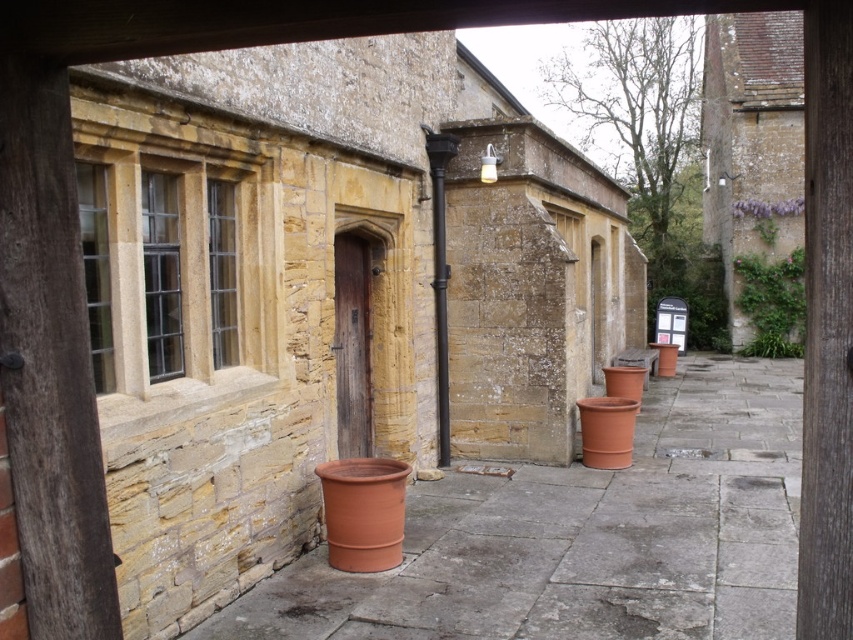
You are standing in front of the stone building and want to determine which of the two points, point (590, 476) or point (766, 268), is closer to you. Based on the scene description, which point is nearer?

Point (590, 476) is closer to the viewer than point (766, 268).

You are a delivery person trying to place a new plant in the middle of the path between the terracotta clay pot at center and the green leafy plant at upper right. If the path is 10 meters long, will the plant fit in the middle?

The distance between the terracotta clay pot at center and the green leafy plant at upper right is 9.73 meters. Placing the new plant in the middle would require half of that distance, which is approximately 4.86 meters from each object. Since the path is 10 meters long, there is sufficient space to place the plant in the middle.

You are a gardener who wants to place a new plant in the scene. The green leafy plant at upper right is already present. Where should you place the new plant to maintain symmetry with the existing terracotta clay pot at center?

The terracotta clay pot at center is positioned on the left side of the green leafy plant at upper right. To maintain symmetry, the new plant should be placed on the right side of the green leafy plant at upper right.